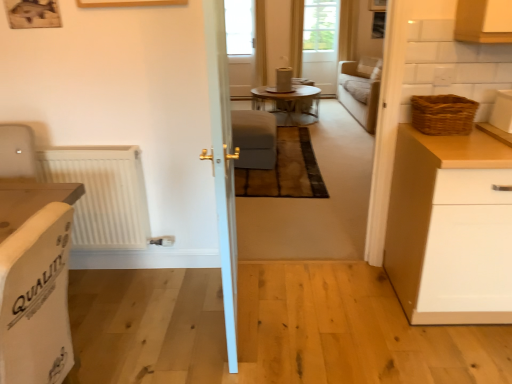
This screenshot has height=384, width=512. I want to click on vacant region to the right of white glossy door at center, so click(x=312, y=315).